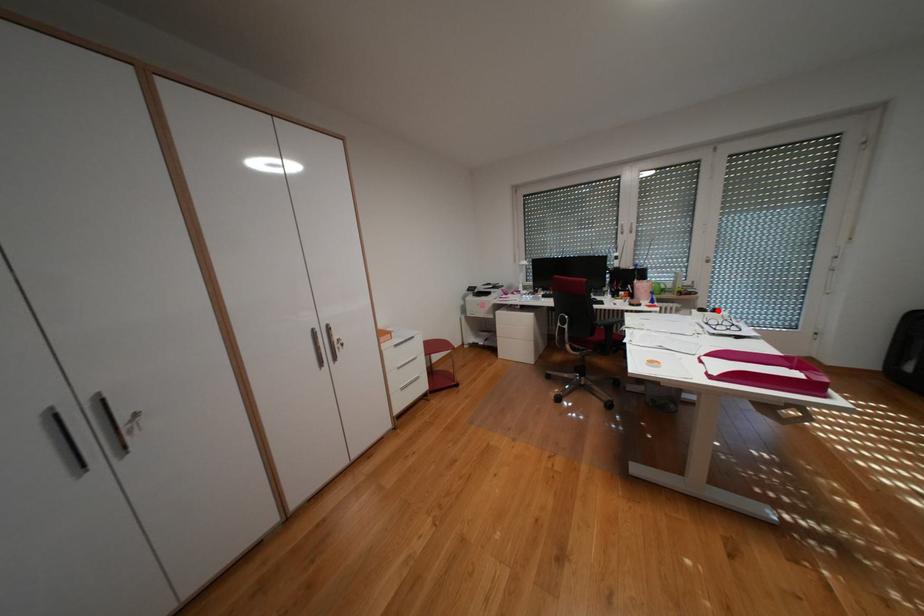
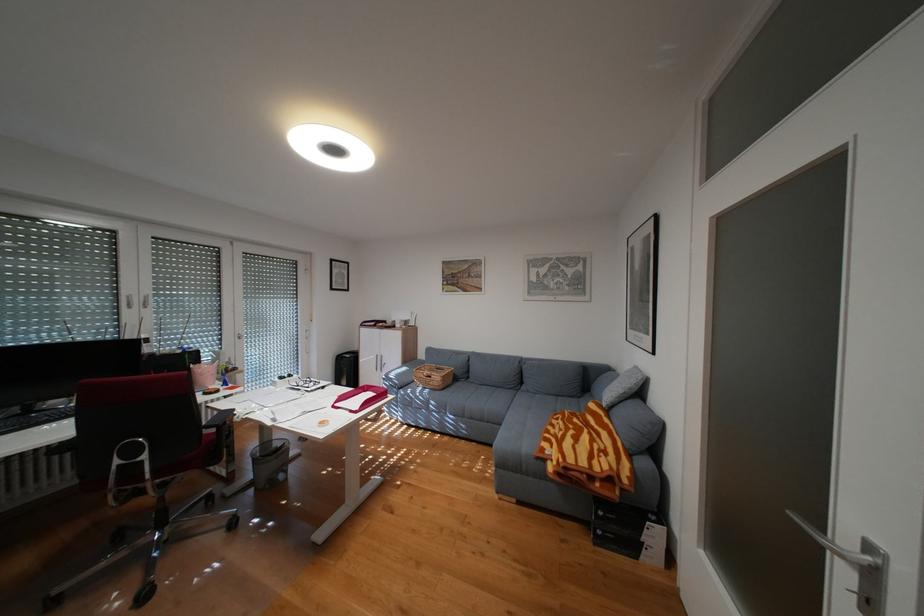
Locate, in the second image, the point that corresponds to the highlighted location in the first image.

(297, 377)